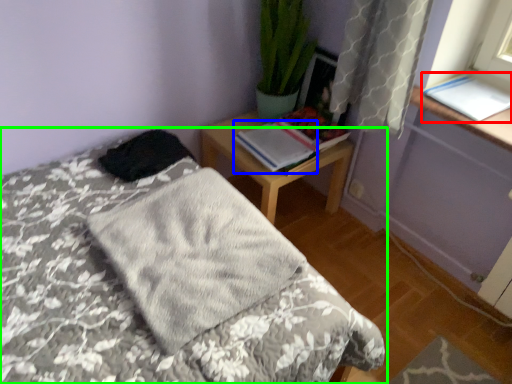
Question: Considering the real-world distances, which object is closest to book (highlighted by a red box)? book (highlighted by a blue box) or bed (highlighted by a green box).

Choices:
 (A) book
 (B) bed

Answer: (A)